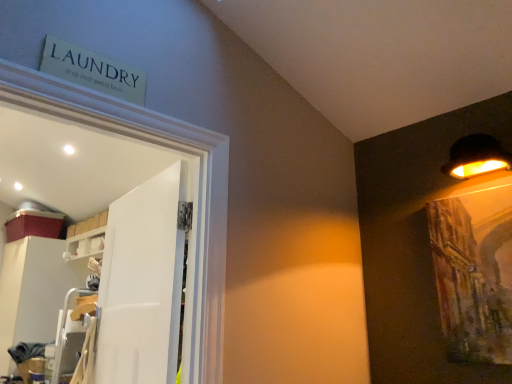
Question: From a real-world perspective, is white glossy shelf at upper left below black matte lampshade at upper right?

Choices:
 (A) yes
 (B) no

Answer: (B)

Question: Can you confirm if white glossy shelf at upper left is shorter than black matte lampshade at upper right?

Choices:
 (A) yes
 (B) no

Answer: (B)

Question: Can you confirm if white glossy shelf at upper left is smaller than black matte lampshade at upper right?

Choices:
 (A) yes
 (B) no

Answer: (B)

Question: Are white glossy shelf at upper left and black matte lampshade at upper right located far from each other?

Choices:
 (A) no
 (B) yes

Answer: (B)

Question: Are white glossy shelf at upper left and black matte lampshade at upper right making contact?

Choices:
 (A) no
 (B) yes

Answer: (A)

Question: Considering the positions of white matte door at center and white glossy cabinet at left in the image, is white matte door at center wider or thinner than white glossy cabinet at left?

Choices:
 (A) thin
 (B) wide

Answer: (A)

Question: Is white matte door at center taller or shorter than white glossy cabinet at left?

Choices:
 (A) short
 (B) tall

Answer: (A)

Question: From a real-world perspective, is white matte door at center above or below white glossy cabinet at left?

Choices:
 (A) above
 (B) below

Answer: (A)

Question: Is white matte door at center bigger or smaller than white glossy cabinet at left?

Choices:
 (A) big
 (B) small

Answer: (B)

Question: Considering the positions of white glossy cabinet at left and black matte lampshade at upper right in the image, is white glossy cabinet at left bigger or smaller than black matte lampshade at upper right?

Choices:
 (A) small
 (B) big

Answer: (B)

Question: From a real-world perspective, is white glossy cabinet at left above or below black matte lampshade at upper right?

Choices:
 (A) above
 (B) below

Answer: (B)

Question: Would you say white glossy cabinet at left is to the left or to the right of black matte lampshade at upper right in the picture?

Choices:
 (A) right
 (B) left

Answer: (B)

Question: Is white glossy cabinet at left in front of or behind black matte lampshade at upper right in the image?

Choices:
 (A) front
 (B) behind

Answer: (B)

Question: Based on their positions, is white glossy shelf at upper left located to the left or right of white glossy cabinet at left?

Choices:
 (A) left
 (B) right

Answer: (B)

Question: Do you think white glossy shelf at upper left is within white glossy cabinet at left, or outside of it?

Choices:
 (A) outside
 (B) inside

Answer: (A)